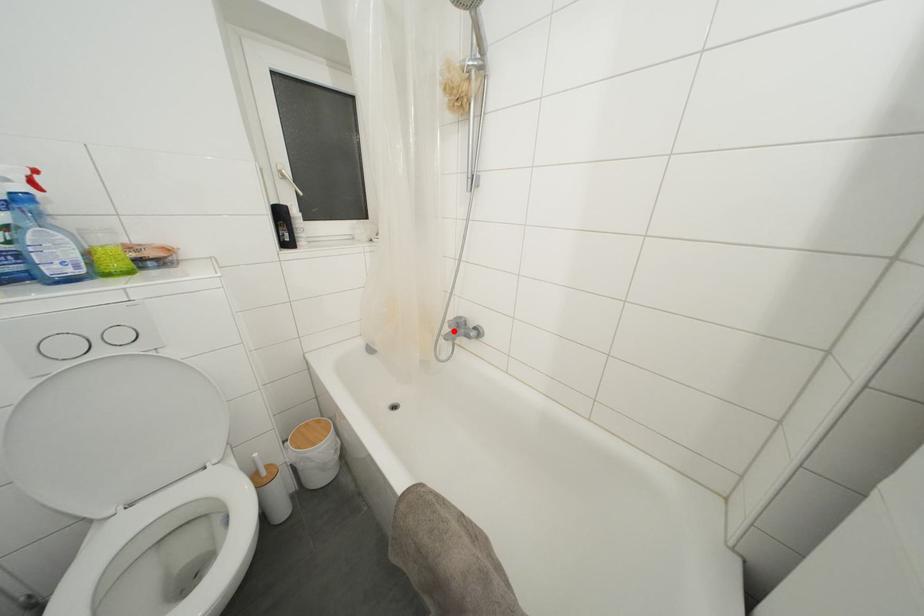
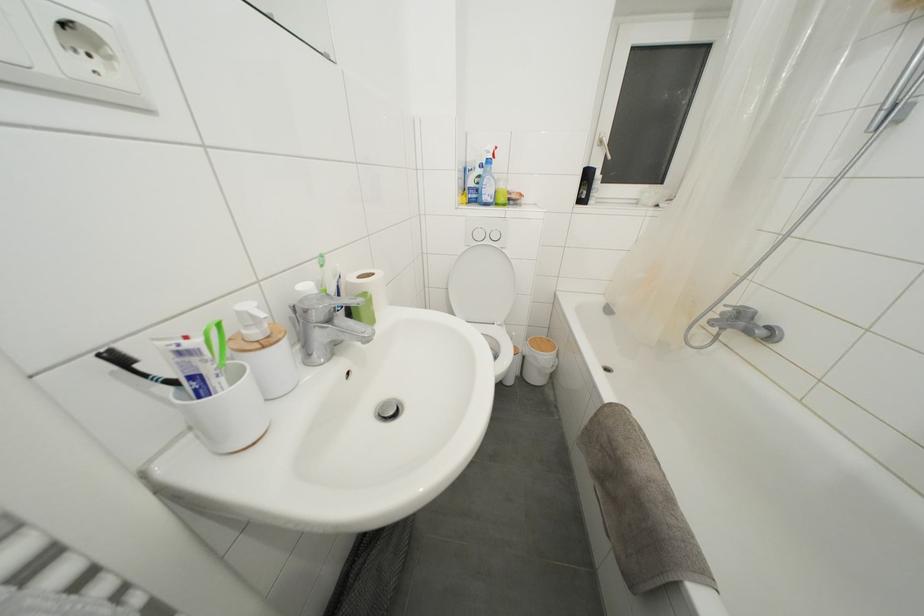
Find the pixel in the second image that matches the highlighted location in the first image.

(726, 318)